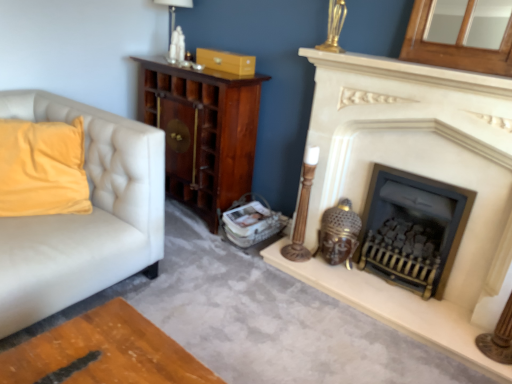
Question: From a real-world perspective, is dark wood cabinet at center below black cast iron wood burning stove at center?

Choices:
 (A) no
 (B) yes

Answer: (A)

Question: Is dark wood cabinet at center oriented towards black cast iron wood burning stove at center?

Choices:
 (A) no
 (B) yes

Answer: (A)

Question: Considering the relative sizes of dark wood cabinet at center and black cast iron wood burning stove at center in the image provided, is dark wood cabinet at center wider than black cast iron wood burning stove at center?

Choices:
 (A) yes
 (B) no

Answer: (A)

Question: Is dark wood cabinet at center further to the viewer compared to black cast iron wood burning stove at center?

Choices:
 (A) yes
 (B) no

Answer: (A)

Question: Is black cast iron wood burning stove at center surrounded by dark wood cabinet at center?

Choices:
 (A) no
 (B) yes

Answer: (A)

Question: Is dark wood cabinet at center not near black cast iron wood burning stove at center?

Choices:
 (A) yes
 (B) no

Answer: (A)

Question: From a real-world perspective, is velvet yellow pillow at left on matte wood drawer at upper center?

Choices:
 (A) no
 (B) yes

Answer: (A)

Question: Can we say velvet yellow pillow at left lies outside matte wood drawer at upper center?

Choices:
 (A) yes
 (B) no

Answer: (A)

Question: Considering the relative sizes of velvet yellow pillow at left and matte wood drawer at upper center in the image provided, is velvet yellow pillow at left thinner than matte wood drawer at upper center?

Choices:
 (A) yes
 (B) no

Answer: (B)

Question: Is the position of velvet yellow pillow at left more distant than that of matte wood drawer at upper center?

Choices:
 (A) no
 (B) yes

Answer: (A)

Question: Is velvet yellow pillow at left positioned with its back to matte wood drawer at upper center?

Choices:
 (A) no
 (B) yes

Answer: (A)

Question: Is velvet yellow pillow at left taller than matte wood drawer at upper center?

Choices:
 (A) yes
 (B) no

Answer: (A)

Question: Considering the relative sizes of black cast iron wood burning stove at center and matte white fireplace at right in the image provided, is black cast iron wood burning stove at center smaller than matte white fireplace at right?

Choices:
 (A) yes
 (B) no

Answer: (A)